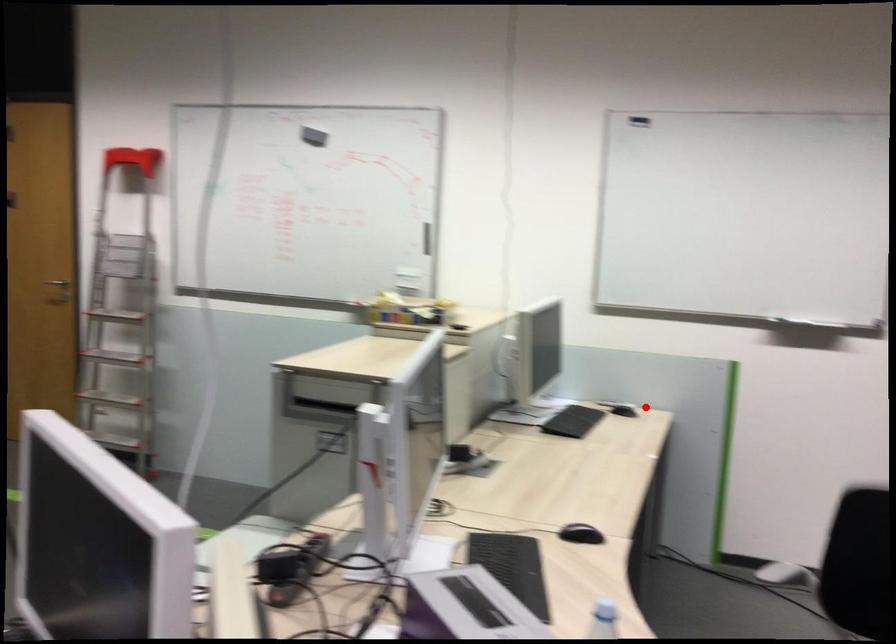
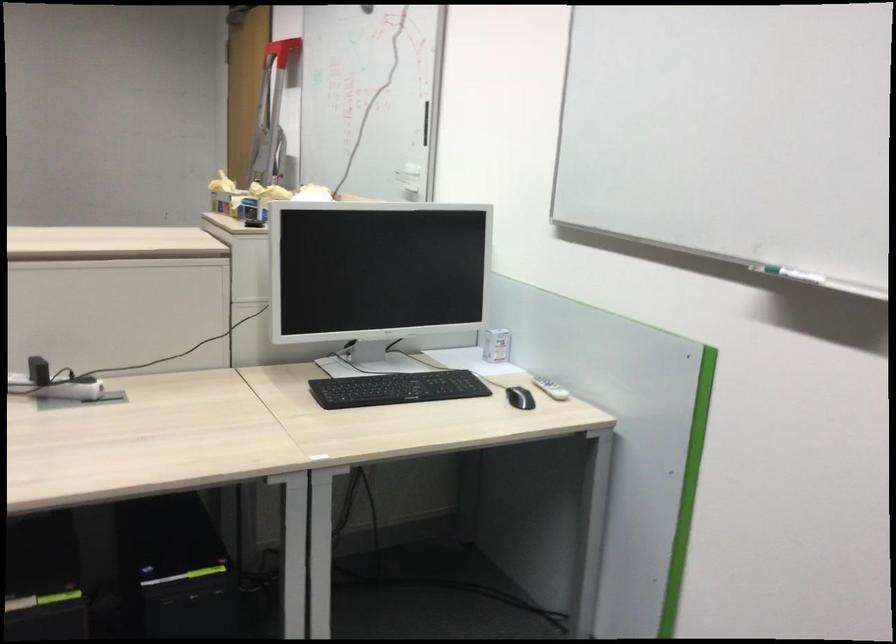
In the second image, find the point that corresponds to the highlighted location in the first image.

(520, 398)